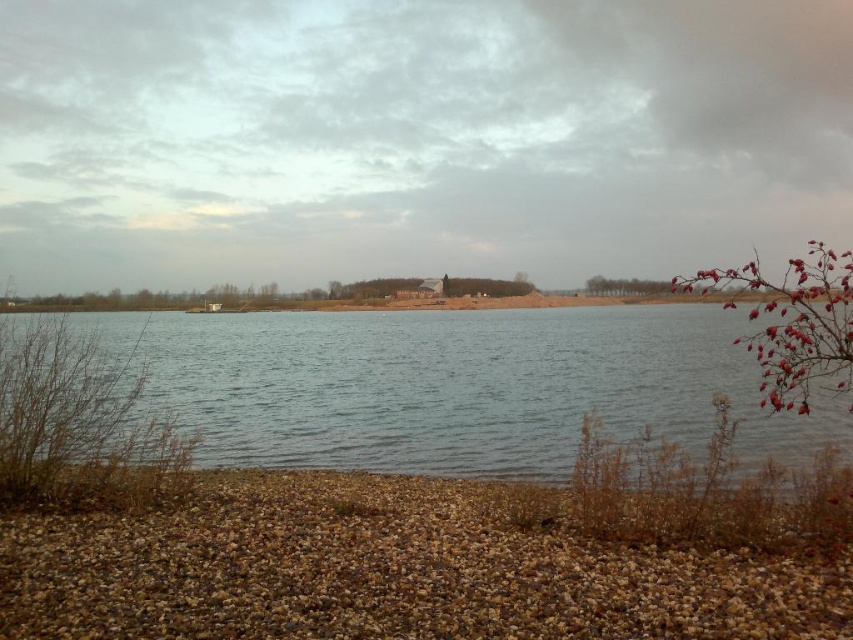
You are standing at the center of the lakeside scene. You want to walk to the point marked as point (389, 572). Which direction should you go?

A: The point (389, 572) is on brown gravel at lower left, so you should go to the lower left direction from your current position at the center to reach it.

You are standing at the edge of the lake and want to walk towards the clear water at center. Which direction should you move relative to the brown gravel at lower left?

You should move away from the brown gravel at lower left because the clear water at center is behind it, farther from your current position.